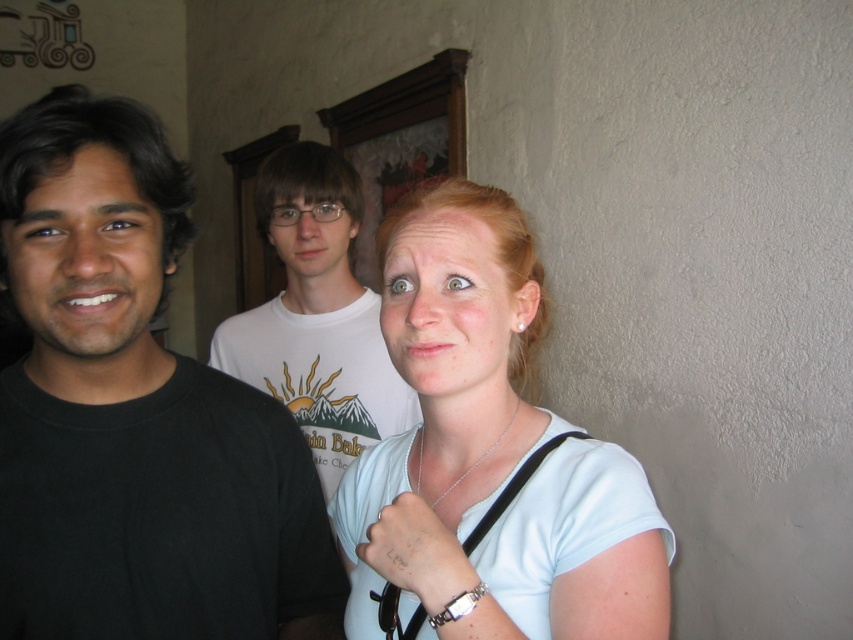
Does black matte shirt at left have a larger size compared to light blue fabric shirt at center?

Correct, black matte shirt at left is larger in size than light blue fabric shirt at center.

Is point (196, 609) farther from camera compared to point (409, 464)?

That is False.

Who is more distant from viewer, (225, 570) or (639, 483)?

The point (225, 570) is behind.

At what (x,y) coordinates should I click in order to perform the action: click on black matte shirt at left. Please return your answer as a coordinate pair (x, y). Image resolution: width=853 pixels, height=640 pixels. Looking at the image, I should click on (132, 410).

Which is in front, point (190, 460) or point (314, 451)?

Point (190, 460) is more forward.

Who is positioned more to the left, black matte shirt at left or white t-shirt at center?

Positioned to the left is black matte shirt at left.

Based on the photo, who is more distant from viewer, (177, 234) or (350, 276)?

Point (350, 276)

Find the location of `black matte shirt at left`. black matte shirt at left is located at coordinates (132, 410).

Locate an element on the screen. light blue fabric shirt at center is located at coordinates (488, 452).

Is light blue fabric shirt at center thinner than white t-shirt at center?

Yes, light blue fabric shirt at center is thinner than white t-shirt at center.

What are the coordinates of `light blue fabric shirt at center` in the screenshot? It's located at (488, 452).